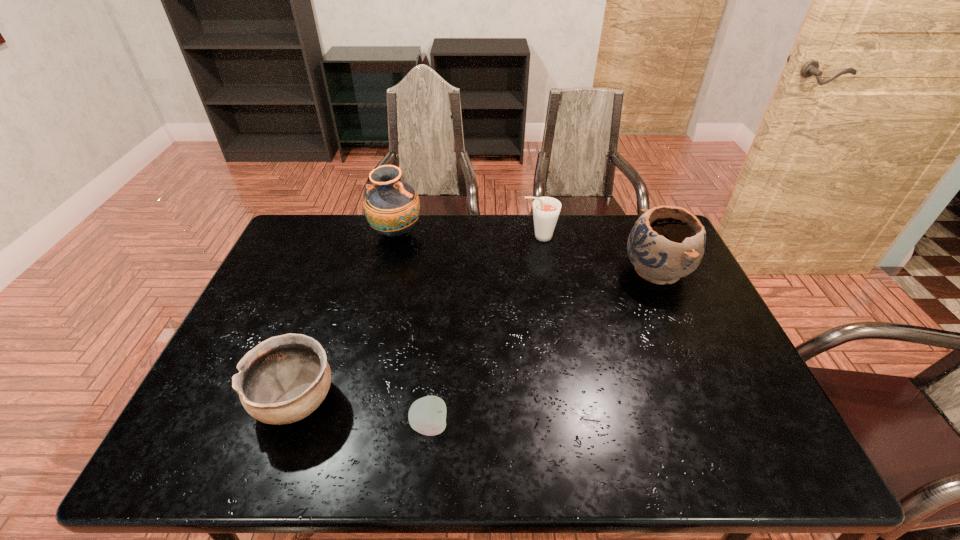
Locate an element on the screen. The image size is (960, 540). vacant space that satisfies the following two spatial constraints: 1. on the back side of the shortest pottery; 2. on the right side of the second shortest pottery is located at coordinates (342, 272).

Identify the location of free spot that satisfies the following two spatial constraints: 1. on the back side of the second shortest object; 2. on the right side of the second shortest pottery. The width and height of the screenshot is (960, 540). (342, 272).